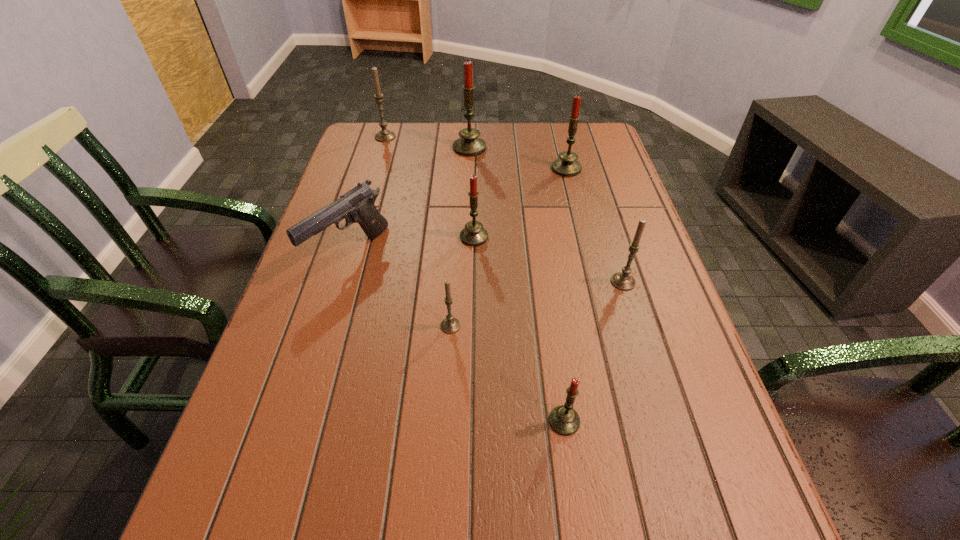
You are a GUI agent. You are given a task and a screenshot of the screen. Output one action in this format:
    pyautogui.click(x=<x>, y=<y>)
    Task: Click on the gun
    
    Given the screenshot: What is the action you would take?
    pyautogui.click(x=357, y=205)

Where is `the nearest candle`? the nearest candle is located at coordinates (564, 420).

Identify the location of the nearest red candle. This screenshot has width=960, height=540. 564,420.

You are a GUI agent. You are given a task and a screenshot of the screen. Output one action in this format:
    pyautogui.click(x=<x>, y=<y>)
    Task: Click on the smallest gray candle
    The height and width of the screenshot is (540, 960).
    Given the screenshot: What is the action you would take?
    pyautogui.click(x=450, y=324)

You are a GUI agent. You are given a task and a screenshot of the screen. Output one action in this format:
    pyautogui.click(x=<x>, y=<y>)
    Task: Click on the nearest gray candle
    The image size is (960, 540).
    Given the screenshot: What is the action you would take?
    [450, 324]

At what (x,y) coordinates should I click in order to perform the action: click on vacant space located 0.310m on the right of the tallest candle. Please return your answer as a coordinate pair (x, y). This screenshot has height=540, width=960. Looking at the image, I should click on (584, 148).

The image size is (960, 540). In order to click on vacant space located on the front of the second biggest red candle in this screenshot , I will do `click(571, 189)`.

This screenshot has height=540, width=960. What are the coordinates of `free spot located on the right of the leftmost candle` in the screenshot? It's located at (481, 137).

What are the coordinates of `blank space located on the right of the third farthest red candle` in the screenshot? It's located at (629, 237).

You are a GUI agent. You are given a task and a screenshot of the screen. Output one action in this format:
    pyautogui.click(x=<x>, y=<y>)
    Task: Click on the vacant space located 0.080m on the left of the second farthest gray candle
    This screenshot has width=960, height=540.
    Given the screenshot: What is the action you would take?
    pyautogui.click(x=575, y=282)